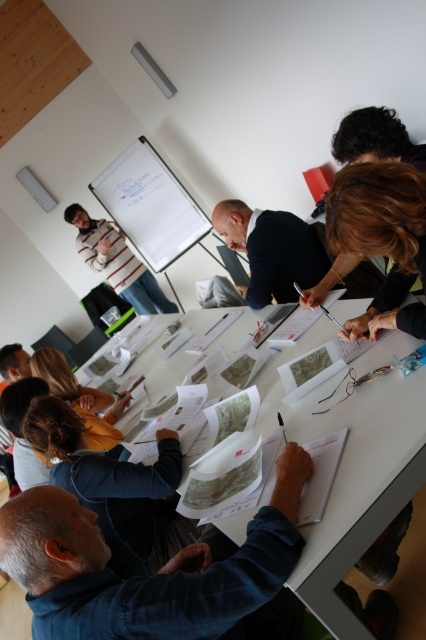
Between point (351, 433) and point (253, 225), which one is positioned behind?

Positioned behind is point (253, 225).

Consider the image. Is white paper at center wider than dark blue suit at center?

Yes, white paper at center is wider than dark blue suit at center.

Who is more distant from viewer, (336, 381) or (304, 244)?

Positioned behind is point (304, 244).

Find the location of a particular element. The height and width of the screenshot is (640, 426). white paper at center is located at coordinates (350, 470).

Is dark blue suit at center to the right of striped cotton shirt at upper left from the viewer's perspective?

Yes, dark blue suit at center is to the right of striped cotton shirt at upper left.

Does point (310, 230) come behind point (129, 280)?

No.

Locate an element on the screen. Image resolution: width=426 pixels, height=640 pixels. dark blue suit at center is located at coordinates (271, 250).

Does white paper at center have a lesser height compared to striped cotton shirt at upper left?

Yes, white paper at center is shorter than striped cotton shirt at upper left.

Can you confirm if white paper at center is taller than striped cotton shirt at upper left?

No.

Where is `white paper at center`? The height and width of the screenshot is (640, 426). white paper at center is located at coordinates click(350, 470).